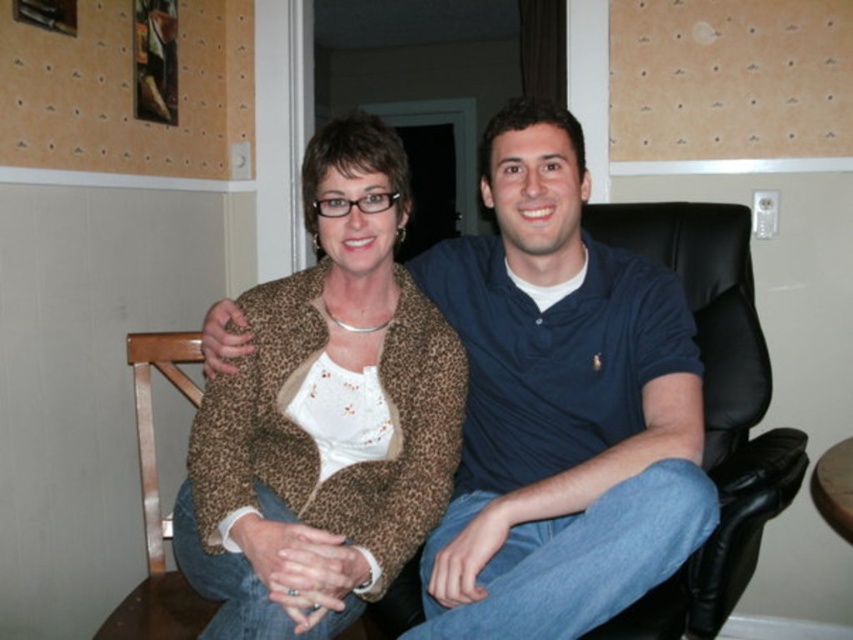
Question: From the image, what is the correct spatial relationship of blue cotton polo shirt at center in relation to black leather swivel chair at right?

Choices:
 (A) below
 (B) above

Answer: (B)

Question: Which of these objects is positioned closest to the black leather swivel chair at right?

Choices:
 (A) blue cotton polo shirt at center
 (B) leopard print jacket at center
 (C) brown corkboard at upper center

Answer: (A)

Question: Which is nearer to the brown corkboard at upper center?

Choices:
 (A) blue cotton polo shirt at center
 (B) black leather swivel chair at right

Answer: (B)

Question: Which point is farther to the camera?

Choices:
 (A) brown corkboard at upper center
 (B) blue cotton polo shirt at center
 (C) black leather swivel chair at right

Answer: (A)

Question: Is blue cotton polo shirt at center above brown corkboard at upper center?

Choices:
 (A) yes
 (B) no

Answer: (B)

Question: Where is blue cotton polo shirt at center located in relation to brown corkboard at upper center in the image?

Choices:
 (A) above
 (B) below

Answer: (B)